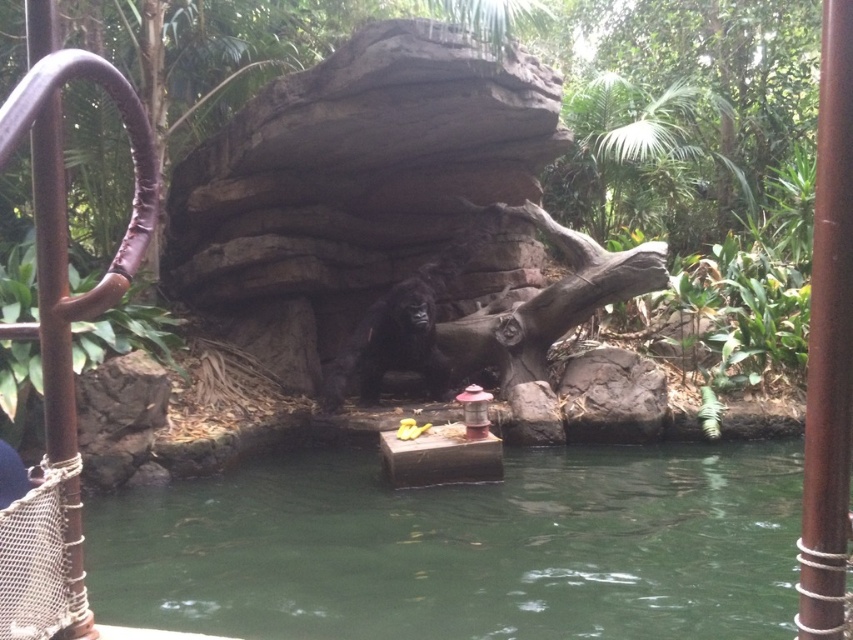
Is brown leather rail at left to the right of dark brown fur gorilla at center from the viewer's perspective?

In fact, brown leather rail at left is to the left of dark brown fur gorilla at center.

From the picture: Is brown leather rail at left below dark brown fur gorilla at center?

Incorrect, brown leather rail at left is not positioned below dark brown fur gorilla at center.

Locate an element on the screen. The height and width of the screenshot is (640, 853). brown leather rail at left is located at coordinates (62, 349).

Locate an element on the screen. The image size is (853, 640). brown leather rail at left is located at coordinates (62, 349).

Measure the distance between green water at center and camera.

green water at center and camera are 3.90 meters apart.

Does green water at center have a lesser height compared to dark brown fur gorilla at center?

Yes.

Find the location of `green water at center`. green water at center is located at coordinates (463, 547).

You are a GUI agent. You are given a task and a screenshot of the screen. Output one action in this format:
    pyautogui.click(x=<x>, y=<y>)
    Task: Click on the green water at center
    This screenshot has width=853, height=640.
    Given the screenshot: What is the action you would take?
    pyautogui.click(x=463, y=547)

Which is behind, point (312, 602) or point (132, 252)?

The point (312, 602) is more distant.

Can you confirm if green water at center is positioned to the left of brown leather rail at left?

No, green water at center is not to the left of brown leather rail at left.

The width and height of the screenshot is (853, 640). What do you see at coordinates (463, 547) in the screenshot?
I see `green water at center` at bounding box center [463, 547].

At what (x,y) coordinates should I click in order to perform the action: click on green water at center. Please return your answer as a coordinate pair (x, y). Looking at the image, I should click on (463, 547).